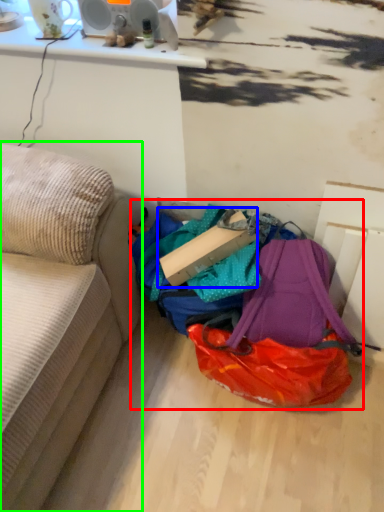
Question: Based on their relative distances, which object is farther from bag (highlighted by a red box)? Choose from cardboard box (highlighted by a blue box) and studio couch (highlighted by a green box).

Choices:
 (A) cardboard box
 (B) studio couch

Answer: (B)